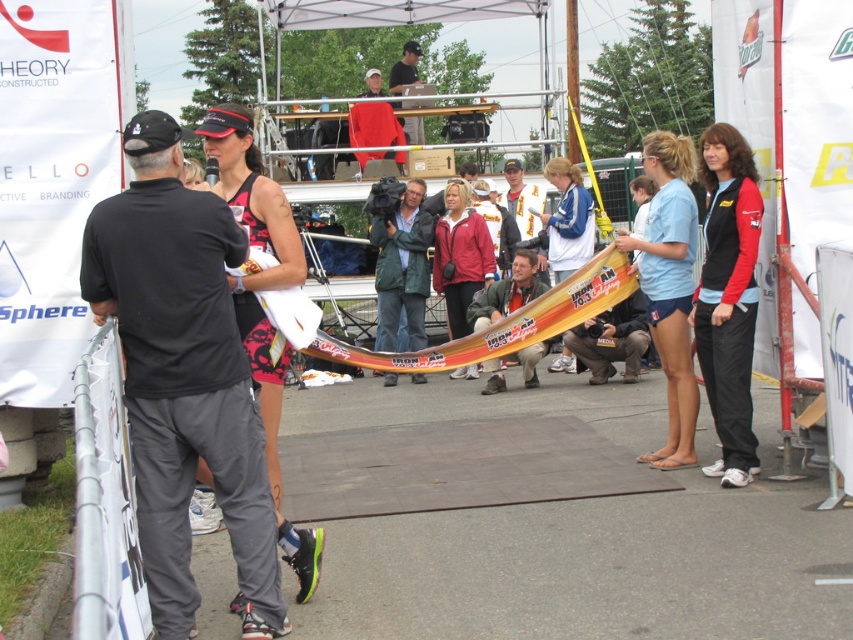
Question: Which of these objects is positioned closest to the black fabric shirt at left?

Choices:
 (A) red fleece jacket at center
 (B) yellow fabric banner at center

Answer: (A)

Question: Does blue fabric jacket at center lie behind black fabric shirt at upper center?

Choices:
 (A) no
 (B) yes

Answer: (A)

Question: Is matte black tank top at center to the left of yellow fabric banner at center from the viewer's perspective?

Choices:
 (A) no
 (B) yes

Answer: (B)

Question: Does black fabric shirt at left come in front of matte red shirt at center?

Choices:
 (A) no
 (B) yes

Answer: (B)

Question: Based on their relative distances, which object is farther from the matte red shirt at center?

Choices:
 (A) matte black tank top at center
 (B) black fabric shirt at left
 (C) yellow fabric banner at center

Answer: (B)

Question: Estimate the real-world distances between objects in this image. Which object is farther from the khaki cotton pants at center?

Choices:
 (A) matte black tank top at center
 (B) black/red fabric vest at right
 (C) metallic gold surfboard at center
 (D) blue fabric jacket at center

Answer: (A)